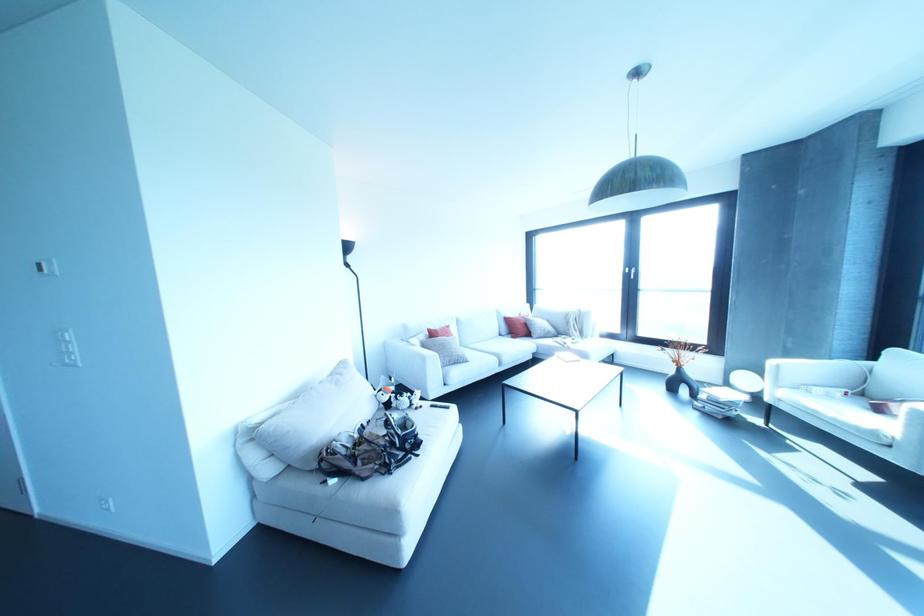
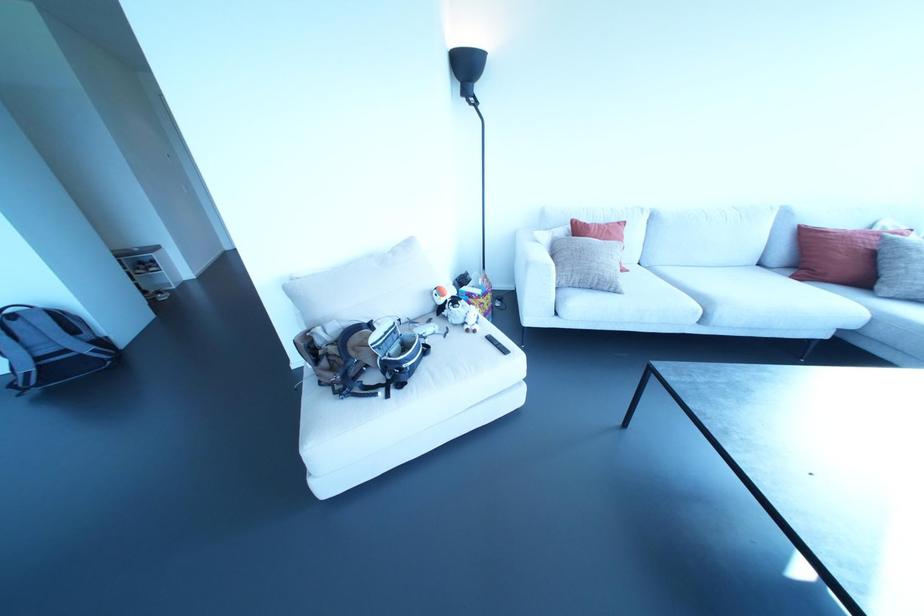
Locate, in the second image, the point that corresponds to point (417, 455) in the first image.

(386, 395)